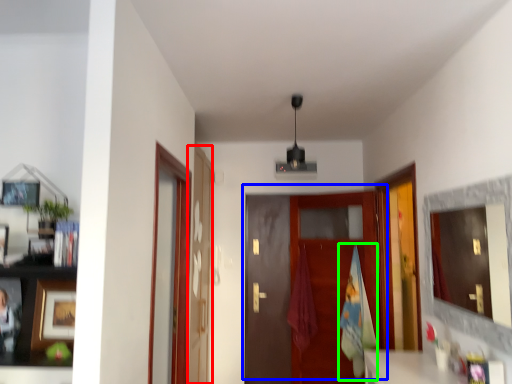
Question: Considering the real-world distances, which object is farthest from glass door (highlighted by a red box)? door (highlighted by a blue box) or bath towel (highlighted by a green box)?

Choices:
 (A) door
 (B) bath towel

Answer: (B)